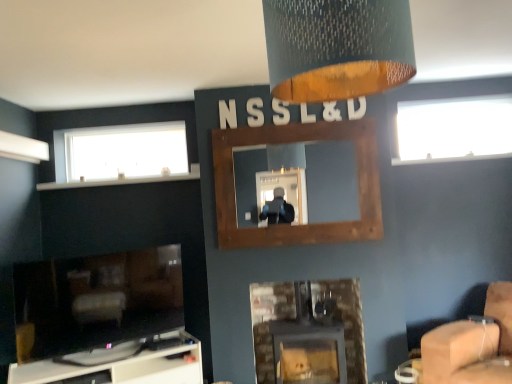
Image resolution: width=512 pixels, height=384 pixels. Describe the element at coordinates (121, 364) in the screenshot. I see `white glossy tv stand at lower left` at that location.

The width and height of the screenshot is (512, 384). Describe the element at coordinates (308, 332) in the screenshot. I see `brick fireplace at center, the 3th fireplace positioned from the left` at that location.

Measure the distance between point (411, 87) and camera.

Point (411, 87) and camera are 3.41 meters apart.

What do you see at coordinates (297, 225) in the screenshot? I see `rustic wood fireplace at center, the 2th fireplace positioned from the right` at bounding box center [297, 225].

This screenshot has height=384, width=512. In order to click on matte black fireplace at lower left, which appears as the 1th fireplace when viewed from the left in this screenshot , I will do click(x=96, y=300).

You are a GUI agent. You are given a task and a screenshot of the screen. Output one action in this format:
    pyautogui.click(x=<x>, y=<y>)
    Task: Click on the white frosted glass window at upper left, which is counted as the second window, starting from the right
    
    Given the screenshot: What is the action you would take?
    pyautogui.click(x=120, y=152)

At what (x,y) coordinates should I click in order to perform the action: click on beige fabric swivel chair at lower right. Please return your answer as a coordinate pair (x, y). The image size is (512, 384). Looking at the image, I should click on (472, 345).

Consider the image. From the image's perspective, would you say brick fireplace at center, acting as the 1th fireplace starting from the right, is shown under beige fabric swivel chair at lower right?

Yes, from the image's perspective, brick fireplace at center, acting as the 1th fireplace starting from the right, is below beige fabric swivel chair at lower right.

Looking at this image, what's the angular difference between brick fireplace at center, the 3th fireplace positioned from the left, and beige fabric swivel chair at lower right's facing directions?

The angular difference between brick fireplace at center, the 3th fireplace positioned from the left, and beige fabric swivel chair at lower right is 47.5 degrees.

Would you say brick fireplace at center, the 3th fireplace positioned from the left, is to the left or to the right of beige fabric swivel chair at lower right in the picture?

brick fireplace at center, the 3th fireplace positioned from the left, is positioned on beige fabric swivel chair at lower right's left side.

Looking at the image, does brick fireplace at center, acting as the 1th fireplace starting from the right, seem bigger or smaller compared to beige fabric swivel chair at lower right?

In the image, brick fireplace at center, acting as the 1th fireplace starting from the right, appears to be smaller than beige fabric swivel chair at lower right.

Is brick fireplace at center, acting as the 1th fireplace starting from the right, not near white glossy tv stand at lower left?

No, there isn't a large distance between brick fireplace at center, acting as the 1th fireplace starting from the right, and white glossy tv stand at lower left.

From the image's perspective, count 1st fireplaces upward from the white glossy tv stand at lower left and point to it. Please provide its 2D coordinates.

[(308, 332)]

Is brick fireplace at center, acting as the 1th fireplace starting from the right, surrounding white glossy tv stand at lower left?

That's incorrect, white glossy tv stand at lower left is not inside brick fireplace at center, acting as the 1th fireplace starting from the right.

Considering the relative positions of brick fireplace at center, the 3th fireplace positioned from the left, and white glossy tv stand at lower left in the image provided, is brick fireplace at center, the 3th fireplace positioned from the left, behind white glossy tv stand at lower left?

That is True.

Is matte black fireplace at lower left, which appears as the 1th fireplace when viewed from the left, not near brick fireplace at center, the 3th fireplace positioned from the left?

Absolutely, matte black fireplace at lower left, which appears as the 1th fireplace when viewed from the left, is distant from brick fireplace at center, the 3th fireplace positioned from the left.

Looking at this image, could brick fireplace at center, acting as the 1th fireplace starting from the right, be considered to be inside matte black fireplace at lower left, marked as the third fireplace in a right-to-left arrangement?

No, brick fireplace at center, acting as the 1th fireplace starting from the right, is not surrounded by matte black fireplace at lower left, marked as the third fireplace in a right-to-left arrangement.

This screenshot has height=384, width=512. Find the location of `window below the transparent glass window at upper right, the first window from the right (from the image's perspective)`. window below the transparent glass window at upper right, the first window from the right (from the image's perspective) is located at coordinates (120, 152).

Between white frosted glass window at upper left, which is counted as the second window, starting from the right, and transparent glass window at upper right, the 2th window viewed from the left, which one is positioned in front?

transparent glass window at upper right, the 2th window viewed from the left, is more forward.

From the image's perspective, which one is positioned lower, white frosted glass window at upper left, the first window positioned from the left, or transparent glass window at upper right, the first window from the right?

white frosted glass window at upper left, the first window positioned from the left, is shown below in the image.

Is white frosted glass window at upper left, the first window positioned from the left, not near transparent glass window at upper right, the first window from the right?

Yes, white frosted glass window at upper left, the first window positioned from the left, and transparent glass window at upper right, the first window from the right, are located far from each other.

Considering the relative sizes of white plastic mantle at upper left and textured fabric lampshade at upper center in the image provided, is white plastic mantle at upper left bigger than textured fabric lampshade at upper center?

Incorrect, white plastic mantle at upper left is not larger than textured fabric lampshade at upper center.

Image resolution: width=512 pixels, height=384 pixels. Find the location of `lamp above the white plastic mantle at upper left (from a real-world perspective)`. lamp above the white plastic mantle at upper left (from a real-world perspective) is located at coordinates (337, 48).

Which is behind, point (127, 181) or point (347, 23)?

The point (127, 181) is farther.

Could you tell me if textured fabric lampshade at upper center is facing white frosted glass window at upper left, which is counted as the second window, starting from the right?

No.

Which is less distant, (325, 17) or (122, 169)?

The point (325, 17) is closer.

Looking at their sizes, would you say textured fabric lampshade at upper center is wider or thinner than white frosted glass window at upper left, the first window positioned from the left?

Considering their sizes, textured fabric lampshade at upper center looks broader than white frosted glass window at upper left, the first window positioned from the left.

Can you confirm if white glossy tv stand at lower left is positioned to the right of textured fabric lampshade at upper center?

In fact, white glossy tv stand at lower left is to the left of textured fabric lampshade at upper center.

Based on the photo, relative to textured fabric lampshade at upper center, is white glossy tv stand at lower left in front or behind?

In the image, white glossy tv stand at lower left appears behind textured fabric lampshade at upper center.

Would you say textured fabric lampshade at upper center is part of white glossy tv stand at lower left's contents?

No, textured fabric lampshade at upper center is not surrounded by white glossy tv stand at lower left.

The width and height of the screenshot is (512, 384). What are the coordinates of `swivel chair located in front of the brick fireplace at center, acting as the 1th fireplace starting from the right` in the screenshot? It's located at (472, 345).

From the image's perspective, starting from the white glossy tv stand at lower left, which fireplace is the 1st one above? Please provide its 2D coordinates.

[(308, 332)]

Estimate the real-world distances between objects in this image. Which object is closer to white plastic mantle at upper left, white glossy tv stand at lower left or matte black fireplace at lower left, which appears as the 1th fireplace when viewed from the left?

matte black fireplace at lower left, which appears as the 1th fireplace when viewed from the left, is positioned closer to the anchor white plastic mantle at upper left.

From the image, which object appears to be nearer to beige fabric swivel chair at lower right, textured fabric lampshade at upper center or white plastic mantle at upper left?

textured fabric lampshade at upper center lies closer to beige fabric swivel chair at lower right than the other object.

Looking at this image, which object lies further to the anchor point textured fabric lampshade at upper center, white frosted glass window at upper left, which is counted as the second window, starting from the right, or transparent glass window at upper right, the 2th window viewed from the left?

Among the two, transparent glass window at upper right, the 2th window viewed from the left, is located further to textured fabric lampshade at upper center.

Which object lies nearer to the anchor point rustic wood fireplace at center, the 2th fireplace positioned from the right, white plastic mantle at upper left or matte black fireplace at lower left, marked as the third fireplace in a right-to-left arrangement?

white plastic mantle at upper left is closer to rustic wood fireplace at center, the 2th fireplace positioned from the right.

From the image, which object appears to be farther from brick fireplace at center, acting as the 1th fireplace starting from the right, white glossy tv stand at lower left or matte black fireplace at lower left, which appears as the 1th fireplace when viewed from the left?

The object further to brick fireplace at center, acting as the 1th fireplace starting from the right, is matte black fireplace at lower left, which appears as the 1th fireplace when viewed from the left.

From the image, which object appears to be farther from transparent glass window at upper right, the 2th window viewed from the left, rustic wood fireplace at center, the 2th fireplace positioned from the right, or white plastic mantle at upper left?

Among the two, white plastic mantle at upper left is located further to transparent glass window at upper right, the 2th window viewed from the left.

From the image, which object appears to be nearer to rustic wood fireplace at center, marked as the 2th fireplace in a left-to-right arrangement, textured fabric lampshade at upper center or brick fireplace at center, acting as the 1th fireplace starting from the right?

brick fireplace at center, acting as the 1th fireplace starting from the right, lies closer to rustic wood fireplace at center, marked as the 2th fireplace in a left-to-right arrangement, than the other object.

When comparing their distances from textured fabric lampshade at upper center, does brick fireplace at center, acting as the 1th fireplace starting from the right, or matte black fireplace at lower left, which appears as the 1th fireplace when viewed from the left, seem further?

brick fireplace at center, acting as the 1th fireplace starting from the right, is positioned further to the anchor textured fabric lampshade at upper center.

Where is `mantle located between white frosted glass window at upper left, which is counted as the second window, starting from the right, and transparent glass window at upper right, the first window from the right, in the left-right direction`? The image size is (512, 384). mantle located between white frosted glass window at upper left, which is counted as the second window, starting from the right, and transparent glass window at upper right, the first window from the right, in the left-right direction is located at coordinates (123, 180).

At what (x,y) coordinates should I click in order to perform the action: click on swivel chair between textured fabric lampshade at upper center and rustic wood fireplace at center, the 2th fireplace positioned from the right, from front to back. Please return your answer as a coordinate pair (x, y). Looking at the image, I should click on (472, 345).

The height and width of the screenshot is (384, 512). What are the coordinates of `furniture between white frosted glass window at upper left, the first window positioned from the left, and transparent glass window at upper right, the 2th window viewed from the left, in the horizontal direction` in the screenshot? It's located at (121, 364).

Identify the location of lamp located between white glossy tv stand at lower left and beige fabric swivel chair at lower right in the left-right direction. (337, 48).